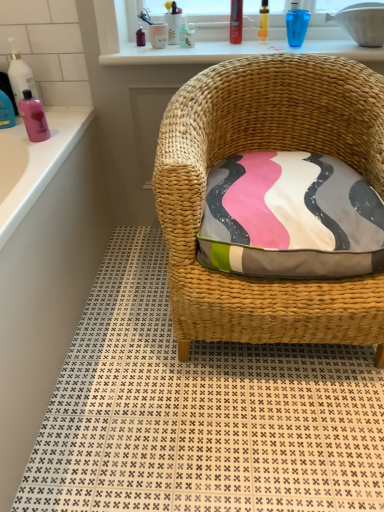
Question: Is translucent plastic bottle at left, placed as the 1th cleaning product when sorted from back to front, taller than woven wicker chair at center?

Choices:
 (A) no
 (B) yes

Answer: (B)

Question: Is woven wicker chair at center completely or partially inside translucent plastic bottle at left, placed as the 1th cleaning product when sorted from back to front?

Choices:
 (A) yes
 (B) no

Answer: (B)

Question: Could you tell me if translucent plastic bottle at left, which is the 1th cleaning product from left to right, is turned towards woven wicker chair at center?

Choices:
 (A) no
 (B) yes

Answer: (A)

Question: Can you confirm if translucent plastic bottle at left, the 2th cleaning product positioned from the front, is positioned to the right of woven wicker chair at center?

Choices:
 (A) yes
 (B) no

Answer: (B)

Question: From the image's perspective, is translucent plastic bottle at left, placed as the 1th cleaning product when sorted from back to front, located beneath woven wicker chair at center?

Choices:
 (A) yes
 (B) no

Answer: (B)

Question: Is translucent plastic bottle at left, which is the first cleaning product in top-to-bottom order, bigger or smaller than woven wicker chair at center?

Choices:
 (A) small
 (B) big

Answer: (A)

Question: From a real-world perspective, is translucent plastic bottle at left, placed as the 1th cleaning product when sorted from back to front, physically located above or below woven wicker chair at center?

Choices:
 (A) below
 (B) above

Answer: (B)

Question: Is translucent plastic bottle at left, which is the 1th cleaning product from left to right, spatially inside woven wicker chair at center, or outside of it?

Choices:
 (A) inside
 (B) outside

Answer: (B)

Question: Would you say translucent plastic bottle at left, which is the 1th cleaning product from left to right, is to the left or to the right of woven wicker chair at center in the picture?

Choices:
 (A) left
 (B) right

Answer: (A)

Question: In terms of width, does translucent yellow bottle at upper center, acting as the second toiletry starting from the right, look wider or thinner when compared to pink glossy bottle at left, positioned as the second cleaning product in back-to-front order?

Choices:
 (A) wide
 (B) thin

Answer: (B)

Question: From the image's perspective, is translucent yellow bottle at upper center, acting as the second toiletry starting from the right, positioned above or below pink glossy bottle at left, the 1th cleaning product ordered from the bottom?

Choices:
 (A) below
 (B) above

Answer: (B)

Question: Considering their positions, is translucent yellow bottle at upper center, acting as the second toiletry starting from the right, located in front of or behind pink glossy bottle at left, which appears as the 2th cleaning product when viewed from the left?

Choices:
 (A) front
 (B) behind

Answer: (B)

Question: Which is correct: translucent yellow bottle at upper center, acting as the second toiletry starting from the right, is inside pink glossy bottle at left, the first cleaning product in the right-to-left sequence, or outside of it?

Choices:
 (A) outside
 (B) inside

Answer: (A)

Question: Is pink glossy bottle at left, positioned as the second cleaning product in back-to-front order, in front of or behind woven wicker chair at center in the image?

Choices:
 (A) behind
 (B) front

Answer: (A)

Question: Considering the positions of pink glossy bottle at left, which appears as the 2th cleaning product when viewed from the left, and woven wicker chair at center in the image, is pink glossy bottle at left, which appears as the 2th cleaning product when viewed from the left, wider or thinner than woven wicker chair at center?

Choices:
 (A) thin
 (B) wide

Answer: (A)